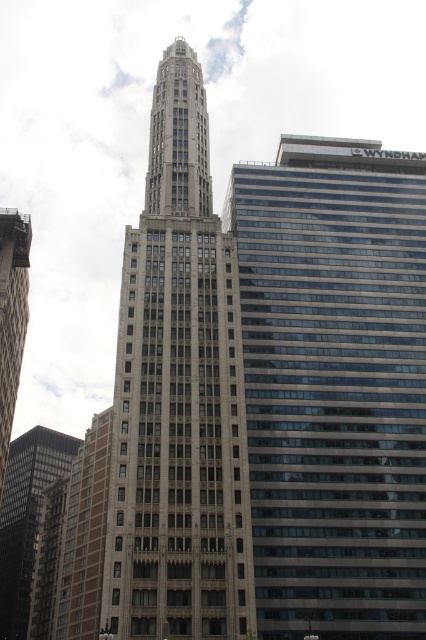
You are a drone operator tasked with flying a drone from the top of the gray stone tower at center to the nearest building. What are the coordinates of the nearest building?

The gray stone tower at center is located at coordinates point (178, 396). The nearest building would be the modern skyscraper with dark glass panels to the right, but since the question specifies the nearest building, we need to determine the distance between the two buildings. However, without additional information on the exact positions of other buildings, it is impossible to provide precise coordinates. The available data only specifies the position of the gray stone tower at center. Therefore, thedr

You are standing at the center of the city square and want to take a photo of the glassy steel skyscraper at center. Based on its coordinates, in which direction should you point your camera to capture it?

The glassy steel skyscraper at center is located at coordinates point (333,385), which is to the lower right of the center point. Therefore, you should point your camera towards the lower right direction to capture it.

You are an urban planner evaluating the city layout. You need to determine which building has a wider base for potential expansion. Based on the scene, which building between the gray stone tower at center and the matte glass skyscraper at left has a wider base?

The matte glass skyscraper at left has a wider base than the gray stone tower at center because the gray stone tower at center is narrower.